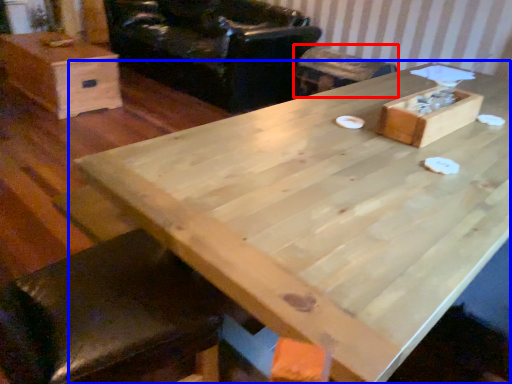
Question: Which object appears farthest to the camera in this image, bar stool (highlighted by a red box) or table (highlighted by a blue box)?

Choices:
 (A) bar stool
 (B) table

Answer: (A)